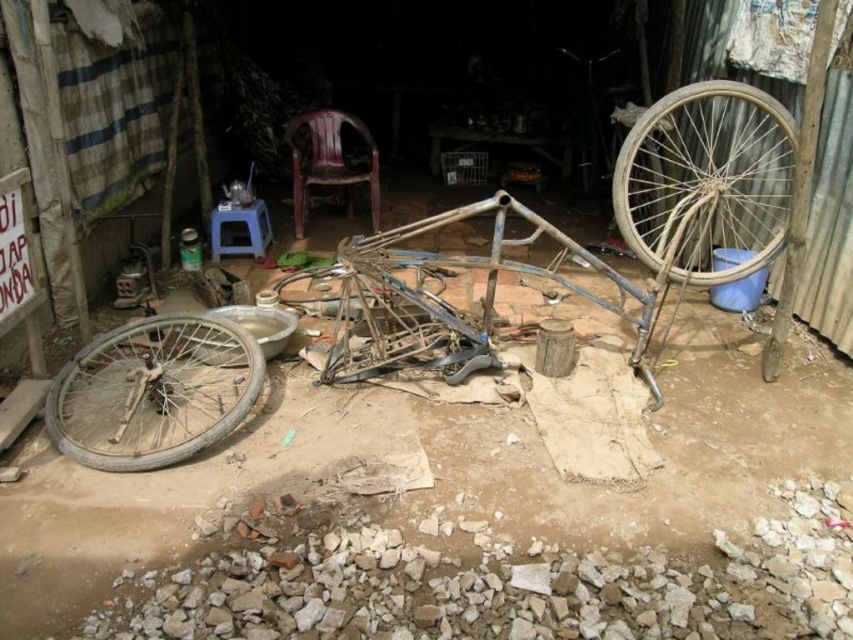
Does rusty metal bicycle frame at center have a larger size compared to rusty metal wheel at lower left?

Indeed, rusty metal bicycle frame at center has a larger size compared to rusty metal wheel at lower left.

Does rusty metal bicycle frame at center appear under rusty metal wheel at lower left?

No, rusty metal bicycle frame at center is not below rusty metal wheel at lower left.

Is point (62, 401) behind point (56, 442)?

Yes, it is behind point (56, 442).

This screenshot has width=853, height=640. I want to click on rusty metal bicycle frame at center, so click(706, 182).

Consider the image. Is rusty metal wheel at right above rusty metal wheel at lower left?

Yes.

Is point (672, 262) closer to camera compared to point (151, 368)?

No, (672, 262) is further to viewer.

Locate an element on the screen. rusty metal wheel at right is located at coordinates (706, 180).

Image resolution: width=853 pixels, height=640 pixels. What do you see at coordinates (706, 182) in the screenshot?
I see `rusty metal bicycle frame at center` at bounding box center [706, 182].

Find the location of a particular element. Image resolution: width=853 pixels, height=640 pixels. rusty metal bicycle frame at center is located at coordinates (706, 182).